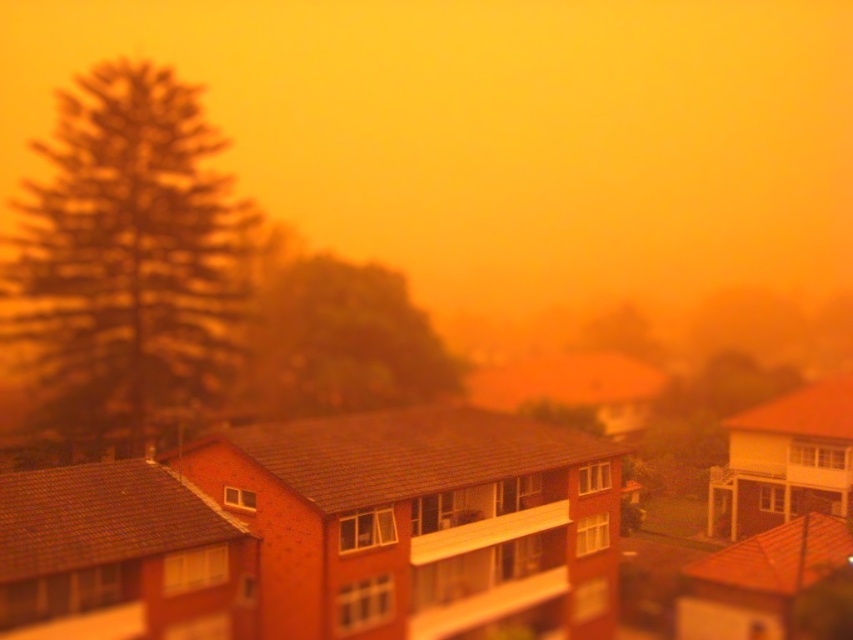
Does green textured tree at left appear under green leafy tree at center?

Actually, green textured tree at left is above green leafy tree at center.

This screenshot has height=640, width=853. Identify the location of green textured tree at left. (126, 260).

Is point (129, 362) closer to viewer compared to point (396, 280)?

Yes, it is.

Identify the location of green textured tree at left. (126, 260).